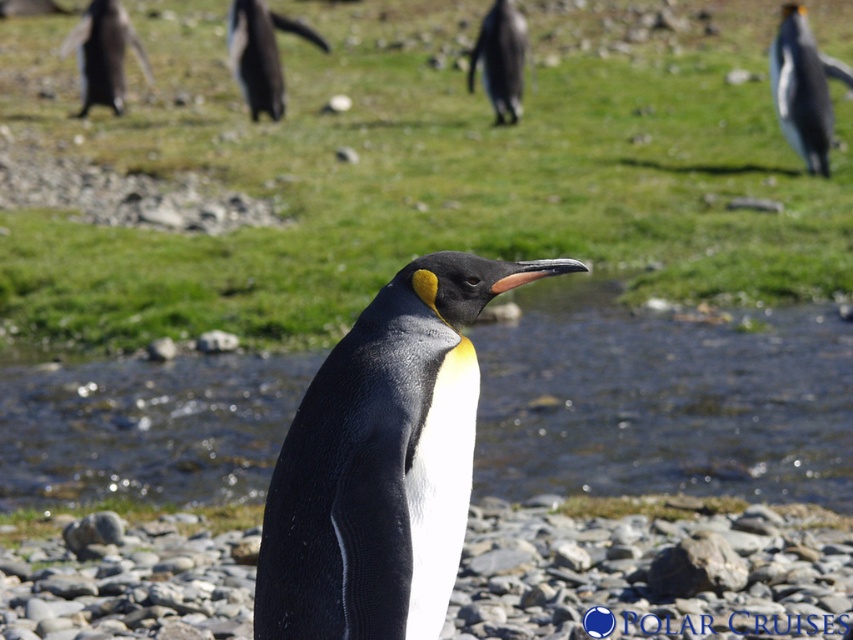
Question: Is clear water at center to the left of black glossy penguin at upper left from the viewer's perspective?

Choices:
 (A) no
 (B) yes

Answer: (A)

Question: Does black smooth rock at center appear under black matte penguin at center?

Choices:
 (A) no
 (B) yes

Answer: (B)

Question: Among these objects, which one is nearest to the camera?

Choices:
 (A) clear water at center
 (B) black glossy penguin at upper left

Answer: (A)

Question: Is green grass at center further to camera compared to black glossy penguin at upper center?

Choices:
 (A) no
 (B) yes

Answer: (A)

Question: Which point is closer to the camera taking this photo?

Choices:
 (A) (807, 426)
 (B) (503, 3)
 (C) (612, 577)

Answer: (C)

Question: Which point appears farthest from the camera in this image?

Choices:
 (A) (345, 506)
 (B) (296, 22)
 (C) (437, 150)
 (D) (665, 531)

Answer: (B)